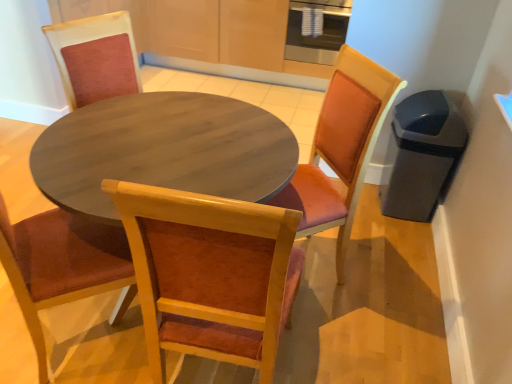
Question: Considering the positions of stainless steel oven at upper center and wooden chair at center, arranged as the second chair when viewed from the back, in the image, is stainless steel oven at upper center wider or thinner than wooden chair at center, arranged as the second chair when viewed from the back,?

Choices:
 (A) wide
 (B) thin

Answer: (B)

Question: From their relative heights in the image, would you say stainless steel oven at upper center is taller or shorter than wooden chair at center, arranged as the second chair when viewed from the back?

Choices:
 (A) tall
 (B) short

Answer: (B)

Question: Which object is positioned farthest from the stainless steel oven at upper center?

Choices:
 (A) wooden chair with orange cushion at center, which appears as the 1th chair when viewed from the back
 (B) wooden chair at center, acting as the first chair starting from the front

Answer: (B)

Question: Estimate the real-world distances between objects in this image. Which object is farther from the stainless steel oven at upper center?

Choices:
 (A) wooden chair with orange cushion at center, which appears as the 1th chair when viewed from the back
 (B) wooden chair at center, arranged as the second chair when viewed from the back

Answer: (B)